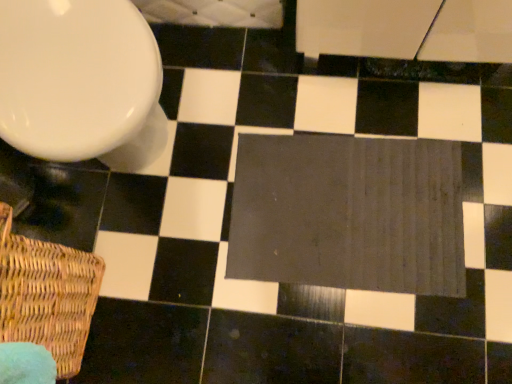
The height and width of the screenshot is (384, 512). Identify the location of free space between white glossy toilet at upper left and woven brown basket at lower left. (120, 232).